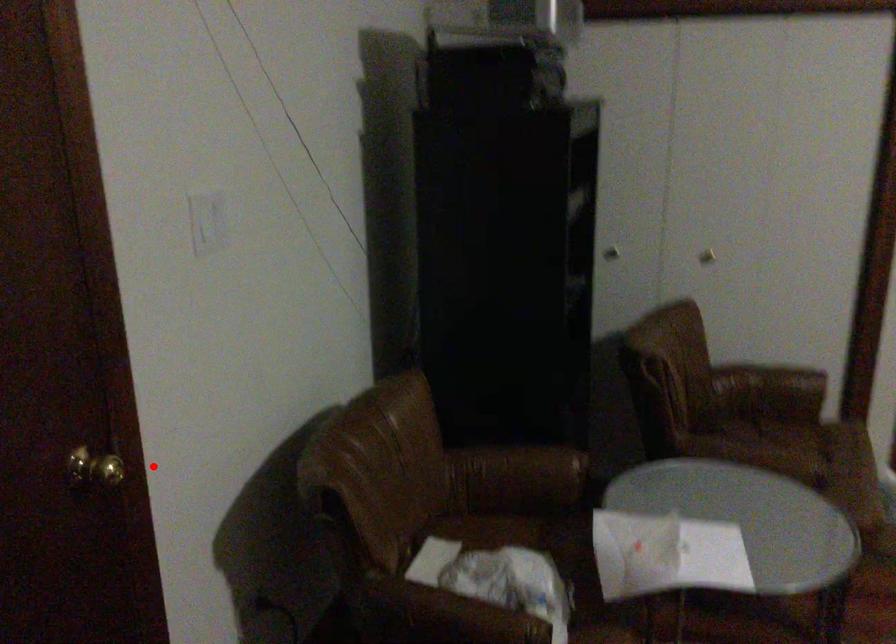
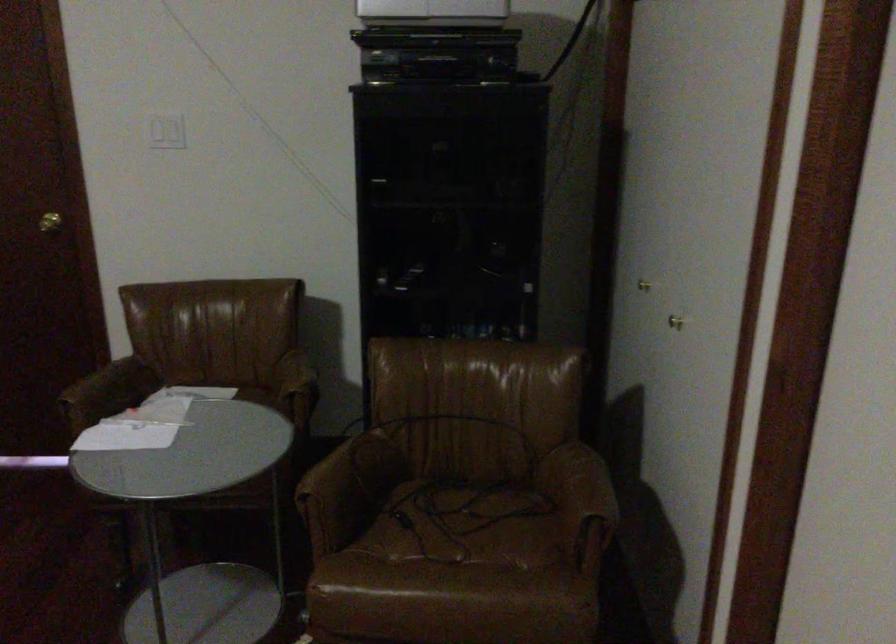
Question: I am providing you with two images of the same scene from different viewpoints. In image1, a red point is highlighted. Considering the same 3D point in image2, which of the following is correct?

Choices:
 (A) It is closer
 (B) It is farther

Answer: (B)